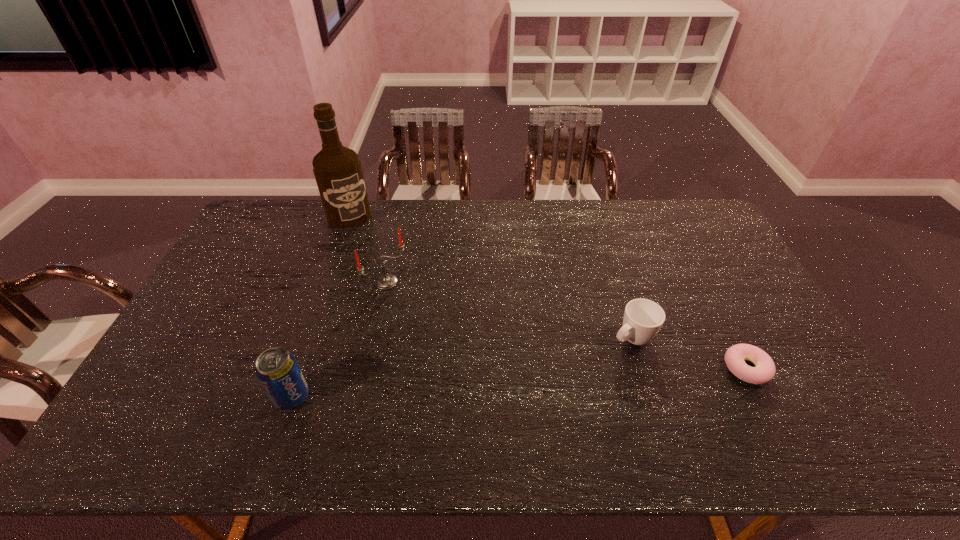
Identify the location of vacant region located 0.360m on the left of the shortest object. (588, 368).

This screenshot has width=960, height=540. In order to click on free space located 0.260m on the front-facing side of the candle in this screenshot , I will do `click(456, 339)`.

Locate an element on the screen. This screenshot has height=540, width=960. vacant point located on the front-facing side of the candle is located at coordinates (418, 307).

Where is `free location located 0.260m on the front-facing side of the candle`? This screenshot has width=960, height=540. free location located 0.260m on the front-facing side of the candle is located at coordinates (456, 339).

At what (x,y) coordinates should I click in order to perform the action: click on vacant space located with the handle on the side of the fourth object from left to right. Please return your answer as a coordinate pair (x, y). The width and height of the screenshot is (960, 540). Looking at the image, I should click on (583, 372).

In order to click on free space located 0.170m with the handle on the side of the fourth object from left to right in this screenshot , I will do coord(571,379).

In order to click on vacant space located with the handle on the side of the fourth object from left to right in this screenshot , I will do `click(561, 387)`.

The image size is (960, 540). I want to click on vacant region located on the label of the farthest object, so click(389, 273).

I want to click on vacant space positioned on the label of the farthest object, so pyautogui.click(x=371, y=246).

You are a GUI agent. You are given a task and a screenshot of the screen. Output one action in this format:
    pyautogui.click(x=<x>, y=<y>)
    Task: Click on the vacant position located 0.050m on the label of the farthest object
    This screenshot has height=540, width=960.
    Given the screenshot: What is the action you would take?
    pyautogui.click(x=362, y=234)